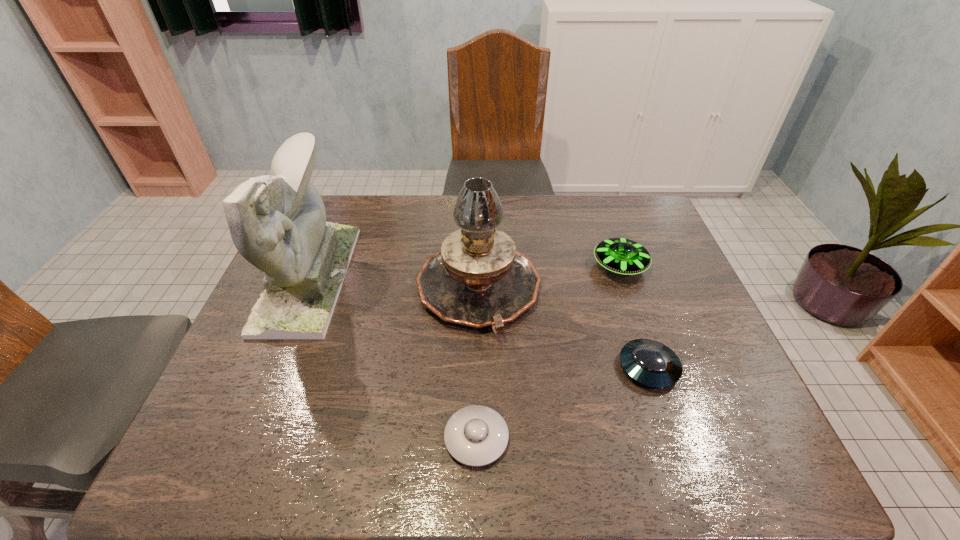
This screenshot has width=960, height=540. Find the location of `vacant region located 0.210m on the back of the farthest saucer`. vacant region located 0.210m on the back of the farthest saucer is located at coordinates (600, 209).

The width and height of the screenshot is (960, 540). In order to click on blank space located 0.060m on the back of the second farthest saucer in this screenshot , I will do `click(635, 325)`.

The image size is (960, 540). I want to click on free point located on the left of the nearest object, so (x=355, y=438).

Identify the location of object located in the far edge section of the desktop. (278, 223).

Locate an element on the screen. The image size is (960, 540). object present at the near edge is located at coordinates (476, 435).

Image resolution: width=960 pixels, height=540 pixels. What are the coordinates of `object located in the left edge section of the desktop` in the screenshot? It's located at (278, 223).

The image size is (960, 540). What are the coordinates of `object present at the far left corner` in the screenshot? It's located at (278, 223).

The width and height of the screenshot is (960, 540). Identify the location of free space at the far edge of the desktop. (419, 197).

In the image, there is a desktop. Identify the location of vacant space at the near edge. (554, 440).

The height and width of the screenshot is (540, 960). In the image, there is a desktop. Identify the location of vacant space at the left edge. (255, 393).